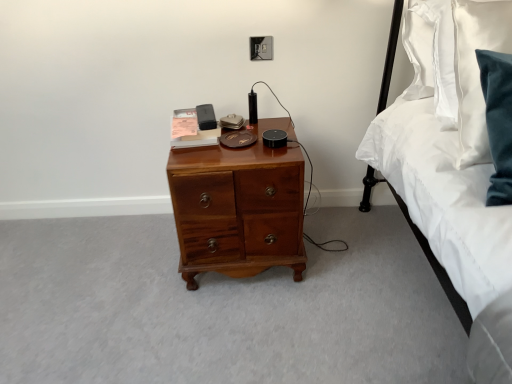
Question: From a real-world perspective, relative to white satin bed at right, is shiny brown wooden chest of drawers at center vertically above or below?

Choices:
 (A) above
 (B) below

Answer: (B)

Question: From the image's perspective, is shiny brown wooden chest of drawers at center located above or below white satin bed at right?

Choices:
 (A) above
 (B) below

Answer: (B)

Question: Which of these objects is positioned closest to the shiny brown wooden chest of drawers at center?

Choices:
 (A) black plastic electric outlet at upper center
 (B) white satin bed at right

Answer: (B)

Question: Estimate the real-world distances between objects in this image. Which object is farther from the white satin bed at right?

Choices:
 (A) black plastic electric outlet at upper center
 (B) shiny brown wooden chest of drawers at center

Answer: (A)